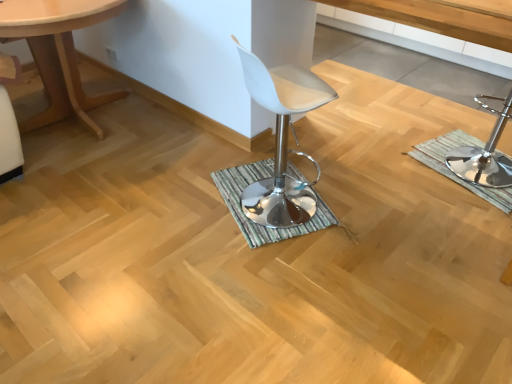
Question: Should I look upward or downward to see green striped bath mat at right, the second bath mat when ordered from left to right?

Choices:
 (A) down
 (B) up

Answer: (B)

Question: Could white leather stool at center be considered to be inside polished chrome bar stool at right?

Choices:
 (A) yes
 (B) no

Answer: (B)

Question: Is polished chrome bar stool at right shorter than white leather stool at center?

Choices:
 (A) no
 (B) yes

Answer: (B)

Question: Is polished chrome bar stool at right in contact with white leather stool at center?

Choices:
 (A) no
 (B) yes

Answer: (A)

Question: Considering the relative sizes of polished chrome bar stool at right and white leather stool at center in the image provided, is polished chrome bar stool at right thinner than white leather stool at center?

Choices:
 (A) yes
 (B) no

Answer: (B)

Question: From a real-world perspective, does polished chrome bar stool at right stand above white leather stool at center?

Choices:
 (A) no
 (B) yes

Answer: (A)

Question: From a real-world perspective, is polished chrome bar stool at right positioned under white leather stool at center based on gravity?

Choices:
 (A) no
 (B) yes

Answer: (B)

Question: Does polished chrome bar stool at right have a greater width compared to light wood table at left?

Choices:
 (A) yes
 (B) no

Answer: (B)

Question: Is polished chrome bar stool at right smaller than light wood table at left?

Choices:
 (A) yes
 (B) no

Answer: (A)

Question: Is polished chrome bar stool at right touching light wood table at left?

Choices:
 (A) yes
 (B) no

Answer: (B)

Question: Could you tell me if polished chrome bar stool at right is turned towards light wood table at left?

Choices:
 (A) no
 (B) yes

Answer: (A)

Question: Can you confirm if polished chrome bar stool at right is taller than light wood table at left?

Choices:
 (A) no
 (B) yes

Answer: (A)

Question: From the image's perspective, is polished chrome bar stool at right located above light wood table at left?

Choices:
 (A) no
 (B) yes

Answer: (A)

Question: From the image's perspective, is green striped bath mat at center, the second bath mat in the right-to-left sequence, beneath light wood table at left?

Choices:
 (A) yes
 (B) no

Answer: (A)